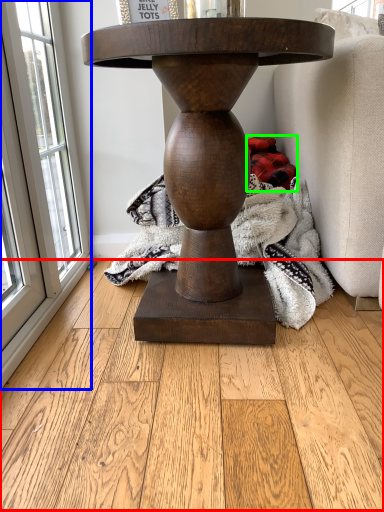
Question: Estimate the real-world distances between objects in this image. Which object is farther from hardwood (highlighted by a red box), window (highlighted by a blue box) or material (highlighted by a green box)?

Choices:
 (A) window
 (B) material

Answer: (B)